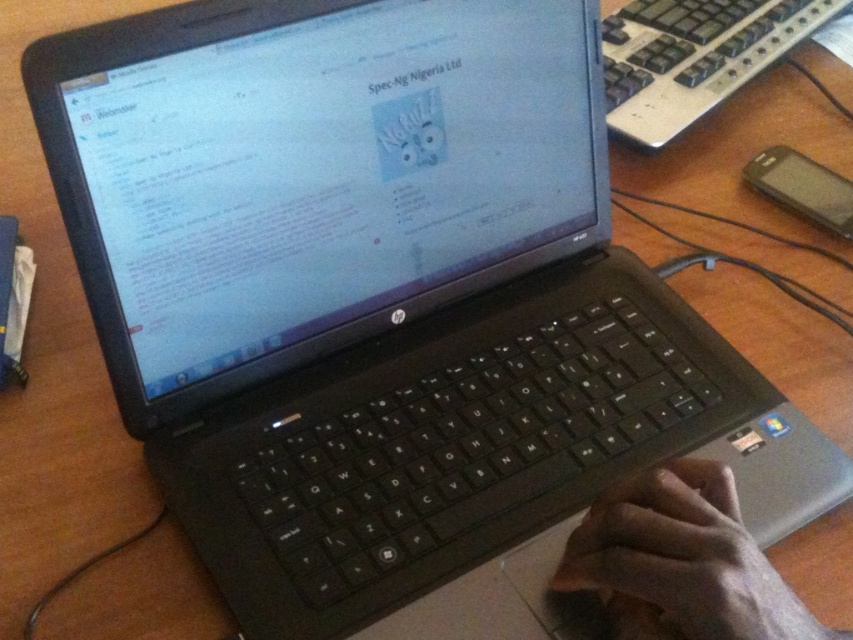
You are taking a photo of the wooden desk and notice two points marked on the image. Which point is closer to the camera, point (714, 545) or point (613, 77)?

Point (714, 545) is closer to the camera than point (613, 77).

You are organizing a workspace and need to move items. If you want to place the skinny white hand at lower right above the black plastic keyboard at upper right, which item is currently in the lower position?

The skinny white hand at lower right is currently below the black plastic keyboard at upper right, so it is in the lower position.

Based on the scene description, where is the skinny white hand at lower right located in terms of coordinates?

The skinny white hand at lower right is located at coordinates point (682, 561).